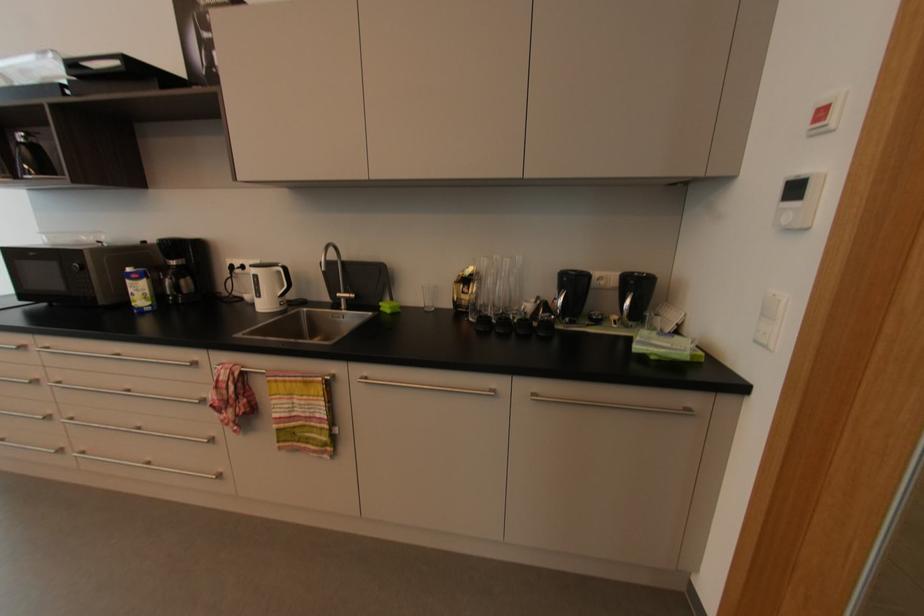
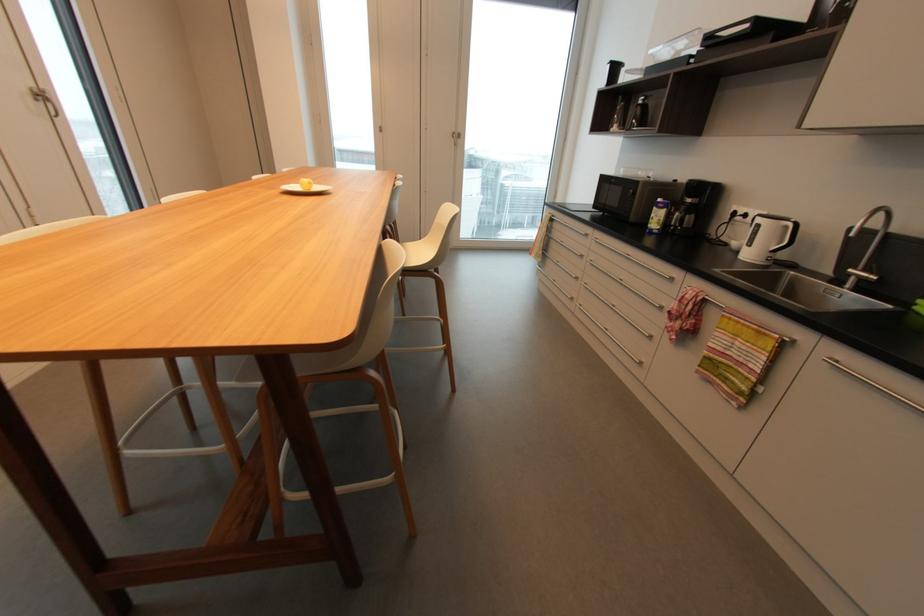
Locate, in the second image, the point that corresponds to point 131,270 in the first image.

(663, 200)